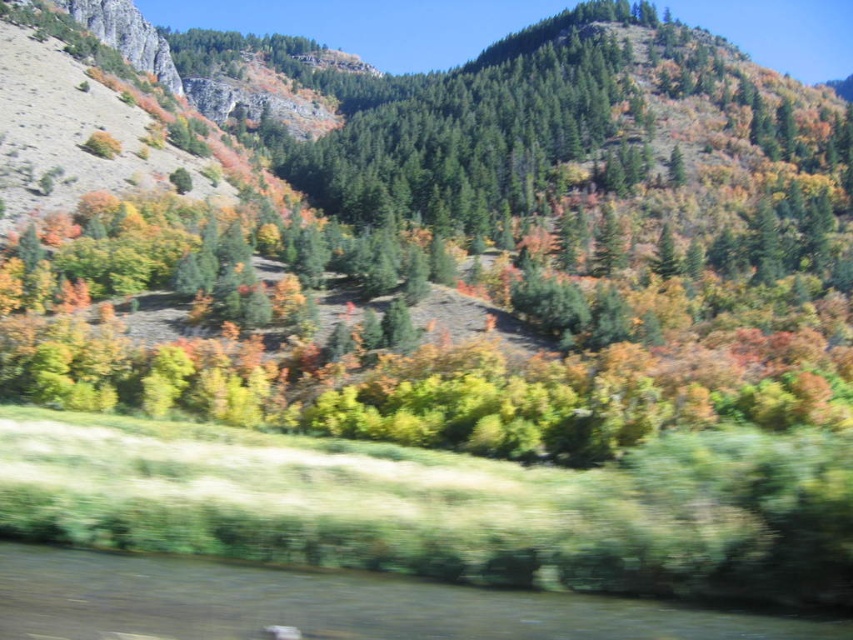
Question: Among these objects, which one is farthest from the camera?

Choices:
 (A) green matte tree at center
 (B) green grassy river at lower center

Answer: (A)

Question: Is green matte tree at center in front of green grassy river at lower center?

Choices:
 (A) yes
 (B) no

Answer: (B)

Question: Which object appears farthest from the camera in this image?

Choices:
 (A) green grassy river at lower center
 (B) green matte tree at center

Answer: (B)

Question: Is green matte tree at center bigger than green grassy river at lower center?

Choices:
 (A) no
 (B) yes

Answer: (B)

Question: Does green matte tree at center lie behind green grassy river at lower center?

Choices:
 (A) yes
 (B) no

Answer: (A)